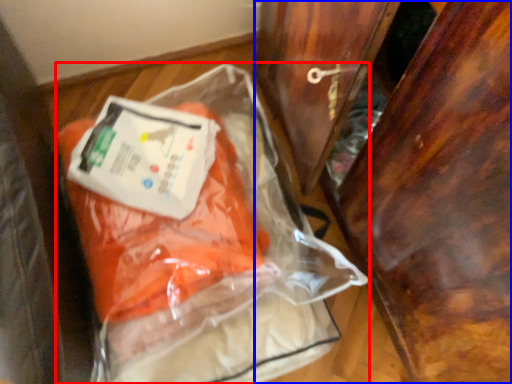
Question: Which object appears farthest to the camera in this image, plastic bag (highlighted by a red box) or furniture (highlighted by a blue box)?

Choices:
 (A) plastic bag
 (B) furniture

Answer: (A)